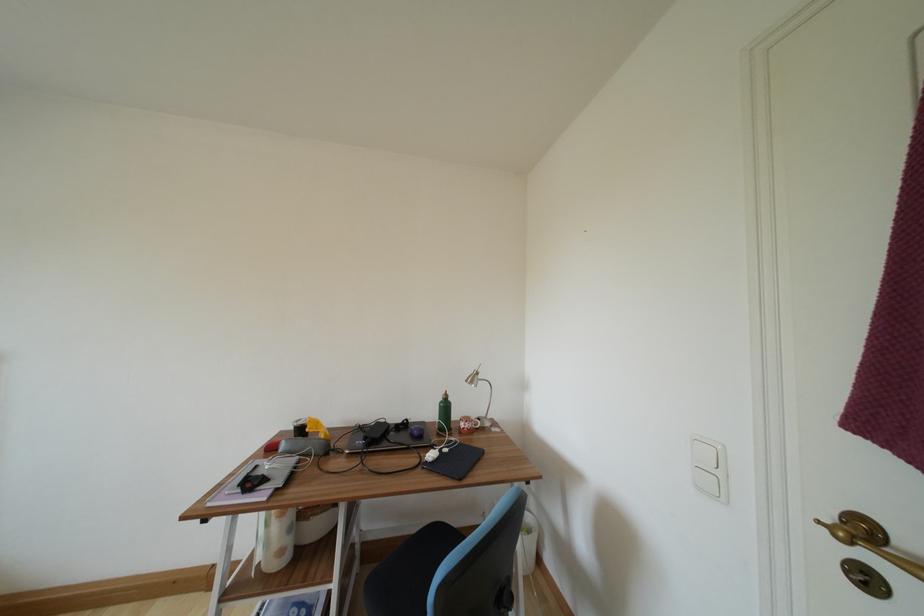
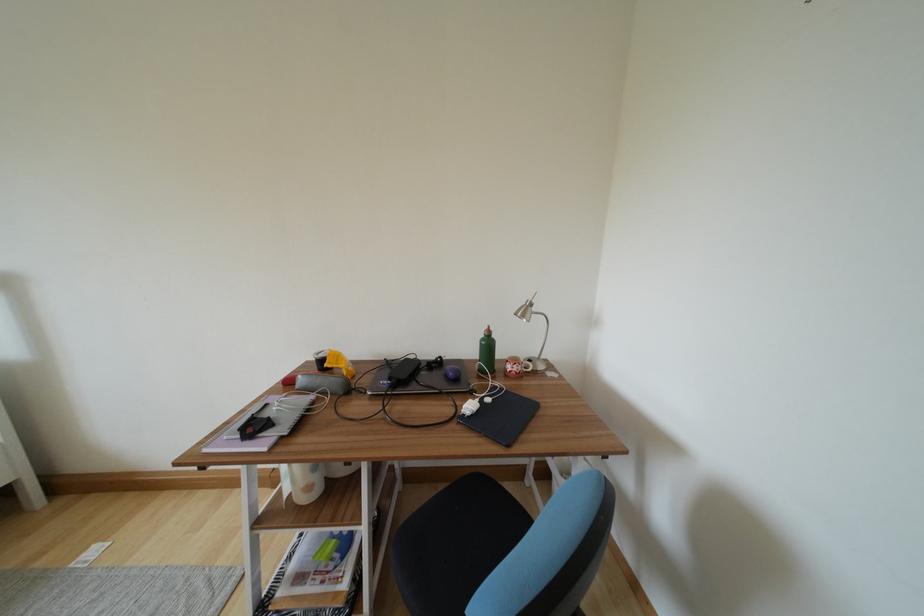
Question: How did the camera likely rotate?

Choices:
 (A) Left
 (B) Right
 (C) Up
 (D) Down

Answer: (D)